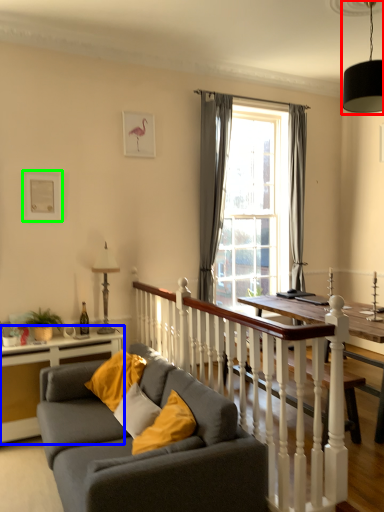
Question: Which object is positioned farthest from light fixture (highlighted by a red box)? Select from table (highlighted by a blue box) and picture frame (highlighted by a green box).

Choices:
 (A) table
 (B) picture frame

Answer: (A)